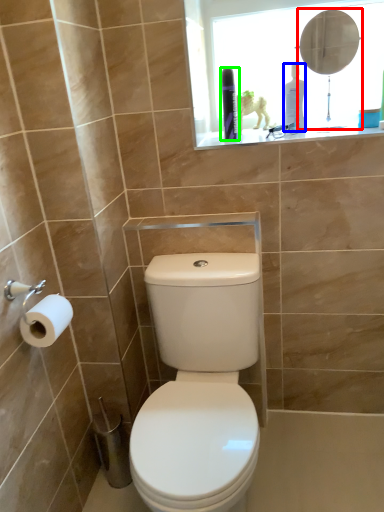
Question: Considering the real-world distances, which object is closest to mirror (highlighted by a red box)? toiletry (highlighted by a blue box) or toiletry (highlighted by a green box).

Choices:
 (A) toiletry
 (B) toiletry

Answer: (A)